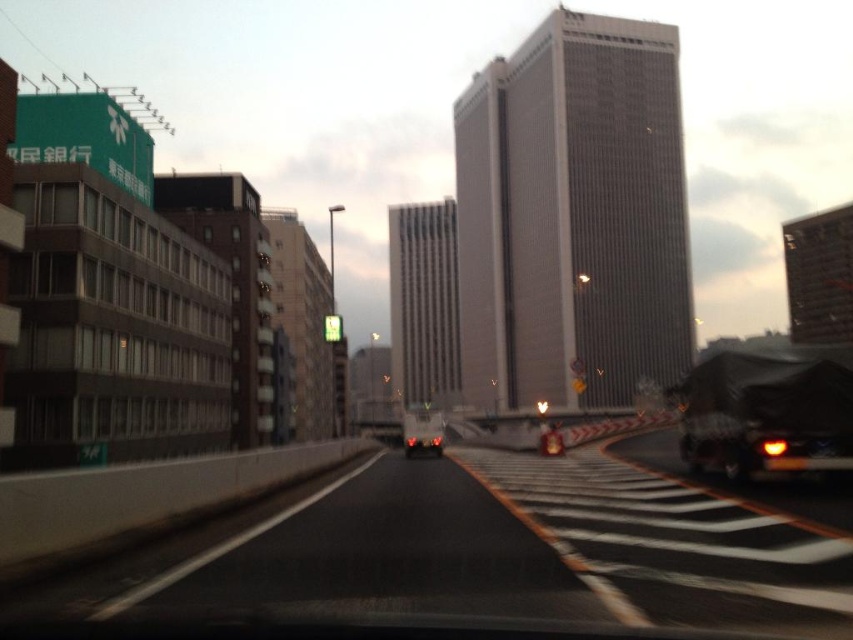
Question: Which object is farther from the camera taking this photo?

Choices:
 (A) matte black car at center
 (B) black asphalt highway at center

Answer: (A)

Question: Which object appears farthest from the camera in this image?

Choices:
 (A) black matte truck at right
 (B) black asphalt highway at center
 (C) matte black car at center

Answer: (C)

Question: Which point is farther from the camera taking this photo?

Choices:
 (A) (488, 557)
 (B) (727, 355)

Answer: (B)

Question: Can you confirm if black matte truck at right is bigger than matte black car at center?

Choices:
 (A) yes
 (B) no

Answer: (B)

Question: Can you confirm if black asphalt highway at center is smaller than black matte truck at right?

Choices:
 (A) yes
 (B) no

Answer: (B)

Question: Observing the image, what is the correct spatial positioning of black asphalt highway at center in reference to black matte truck at right?

Choices:
 (A) below
 (B) above

Answer: (A)